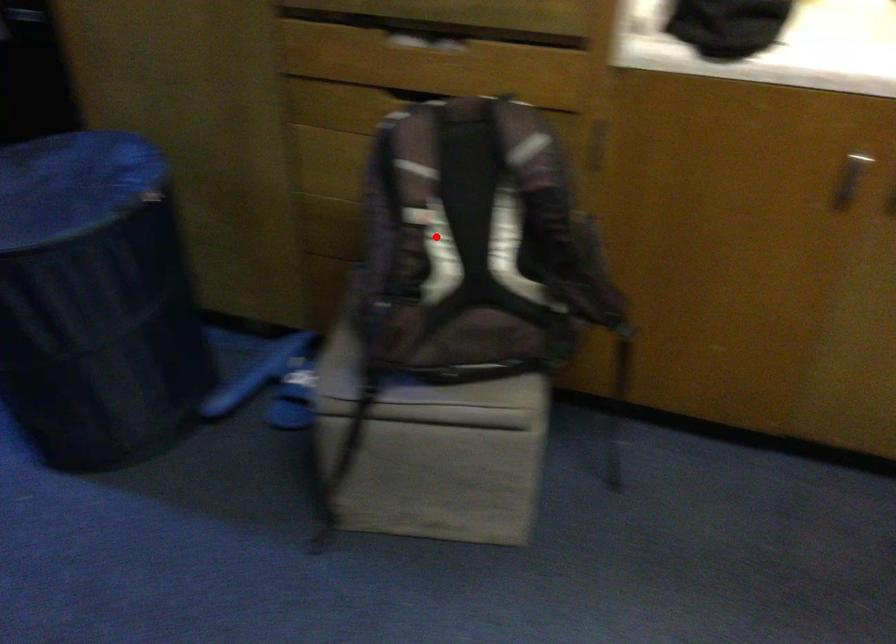
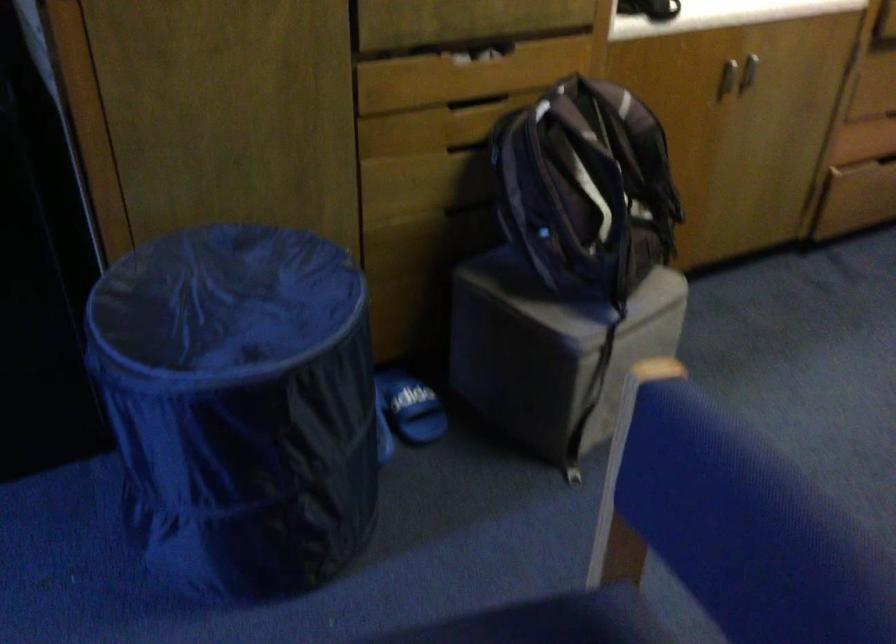
Question: I am providing you with two images of the same scene from different viewpoints. In image1, a red point is highlighted. Considering the same 3D point in image2, which of the following is correct?

Choices:
 (A) It is closer
 (B) It is farther

Answer: (B)